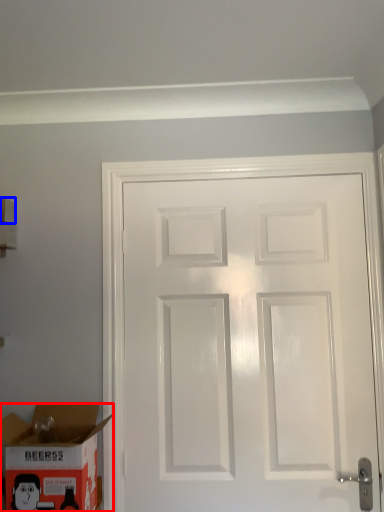
Question: Which object is further to the camera taking this photo, box (highlighted by a red box) or box (highlighted by a blue box)?

Choices:
 (A) box
 (B) box

Answer: (B)